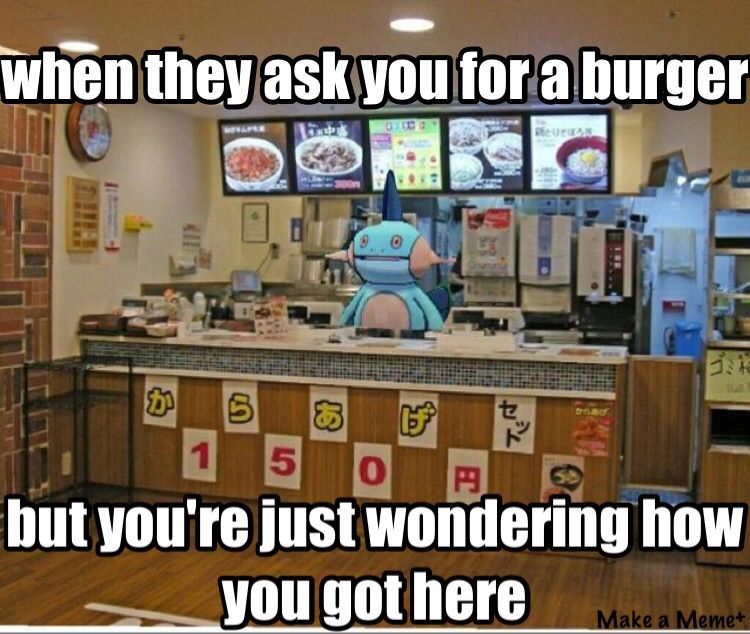
Where is `counter`? counter is located at coordinates (261, 352).